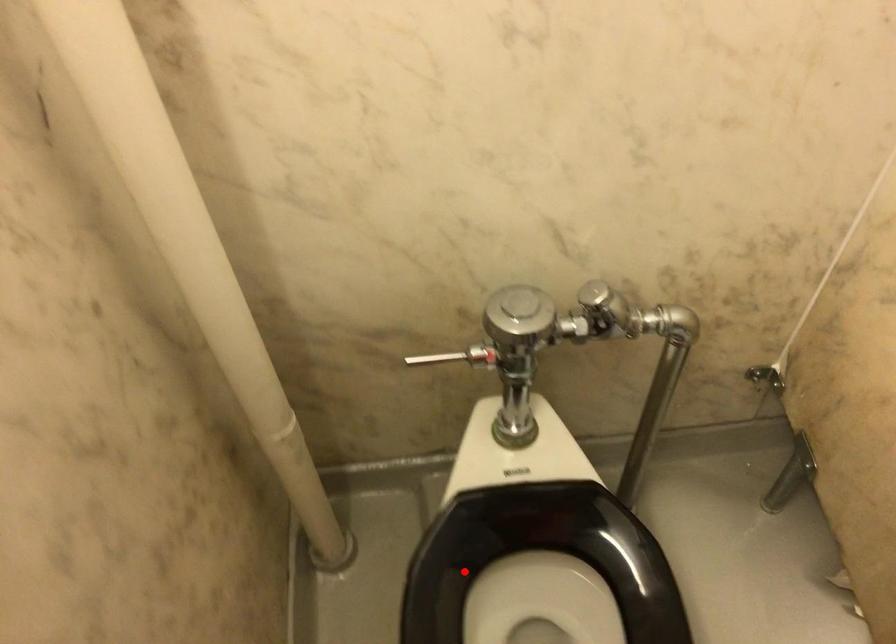
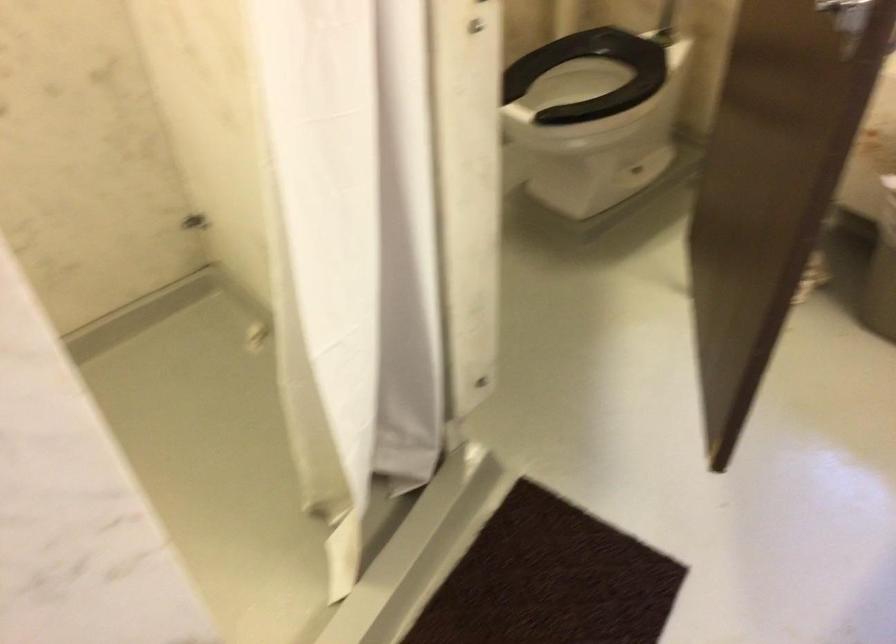
Where in the second image is the point corresponding to the highlighted location from the first image?

(591, 75)